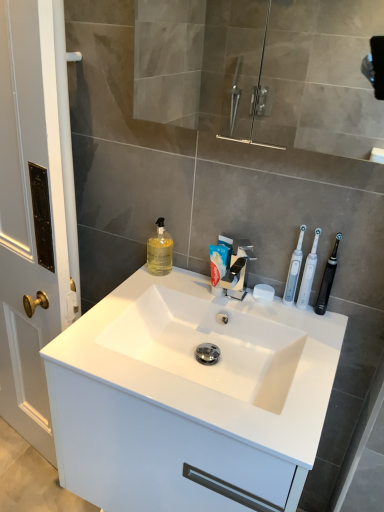
In order to click on vacant area that is in front of white plastic toothbrush at right, the 2th toothbrush in the right-to-left sequence in this screenshot , I will do `click(311, 339)`.